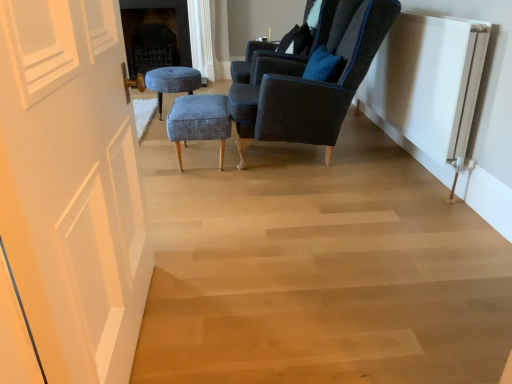
At what (x,y) coordinates should I click in order to perform the action: click on vacant area to the right of white painted wood door at left. Please return your answer as a coordinate pair (x, y). The width and height of the screenshot is (512, 384). Looking at the image, I should click on (264, 326).